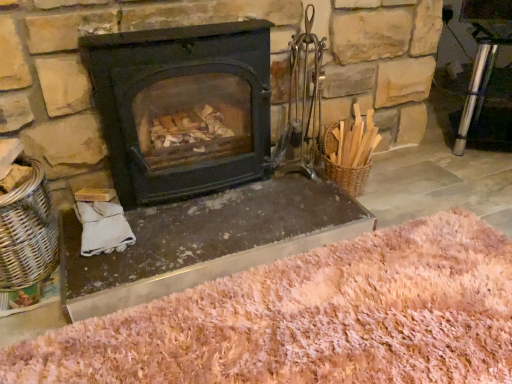
Question: Is pink shaggy rug at lower center wider than woven wicker basket at left?

Choices:
 (A) yes
 (B) no

Answer: (A)

Question: Considering the relative positions of pink shaggy rug at lower center and woven wicker basket at left in the image provided, is pink shaggy rug at lower center in front of woven wicker basket at left?

Choices:
 (A) yes
 (B) no

Answer: (A)

Question: From a real-world perspective, is pink shaggy rug at lower center physically above woven wicker basket at left?

Choices:
 (A) no
 (B) yes

Answer: (A)

Question: Is pink shaggy rug at lower center not close to woven wicker basket at left?

Choices:
 (A) no
 (B) yes

Answer: (A)

Question: Considering the relative positions of pink shaggy rug at lower center and woven wicker basket at left in the image provided, is pink shaggy rug at lower center to the right of woven wicker basket at left from the viewer's perspective?

Choices:
 (A) yes
 (B) no

Answer: (A)

Question: Is pink shaggy rug at lower center outside of woven wicker basket at left?

Choices:
 (A) no
 (B) yes

Answer: (B)

Question: From a real-world perspective, is pink shaggy rug at lower center located higher than metallic gray fireplace at center?

Choices:
 (A) yes
 (B) no

Answer: (B)

Question: From the image's perspective, does pink shaggy rug at lower center appear higher than metallic gray fireplace at center?

Choices:
 (A) yes
 (B) no

Answer: (B)

Question: Does pink shaggy rug at lower center have a larger size compared to metallic gray fireplace at center?

Choices:
 (A) no
 (B) yes

Answer: (B)

Question: From the image's perspective, would you say pink shaggy rug at lower center is shown under metallic gray fireplace at center?

Choices:
 (A) yes
 (B) no

Answer: (A)

Question: Is metallic gray fireplace at center located within pink shaggy rug at lower center?

Choices:
 (A) yes
 (B) no

Answer: (B)

Question: Is there a large distance between pink shaggy rug at lower center and metallic gray fireplace at center?

Choices:
 (A) yes
 (B) no

Answer: (B)

Question: Is the depth of matte black wood burning stove at center greater than that of woven wicker basket at left?

Choices:
 (A) yes
 (B) no

Answer: (A)